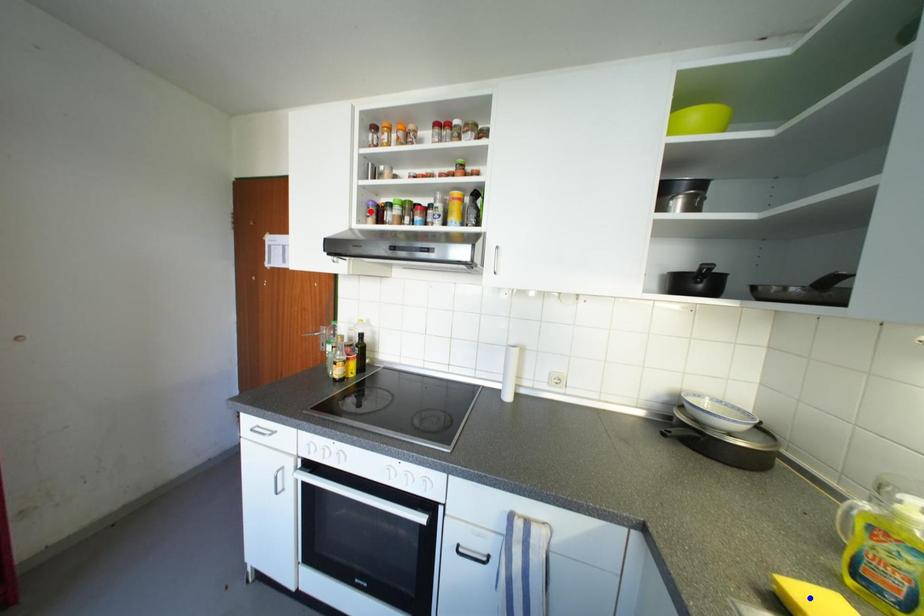
Question: Which of the two points in the image is closer to the camera?

Choices:
 (A) Blue point is closer.
 (B) Red point is closer.

Answer: (A)